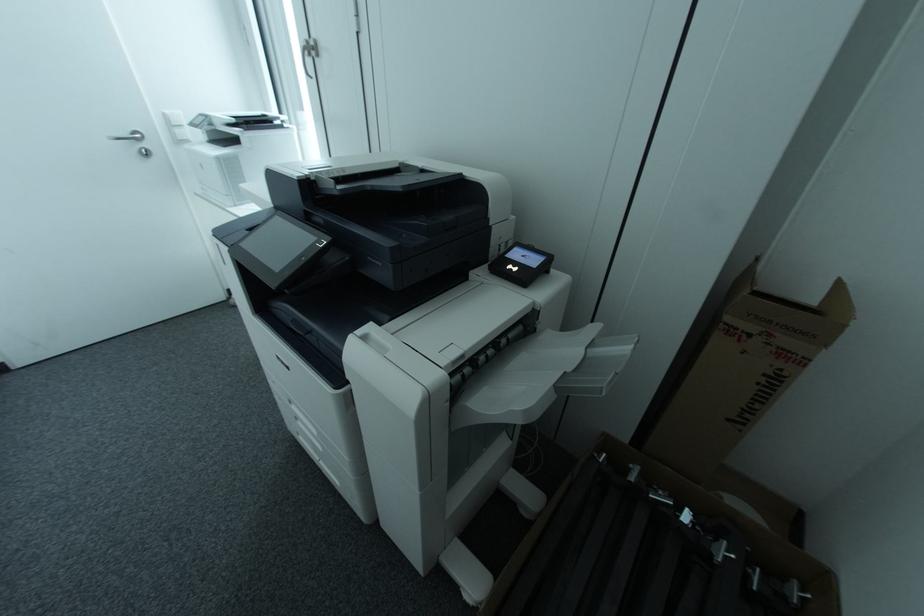
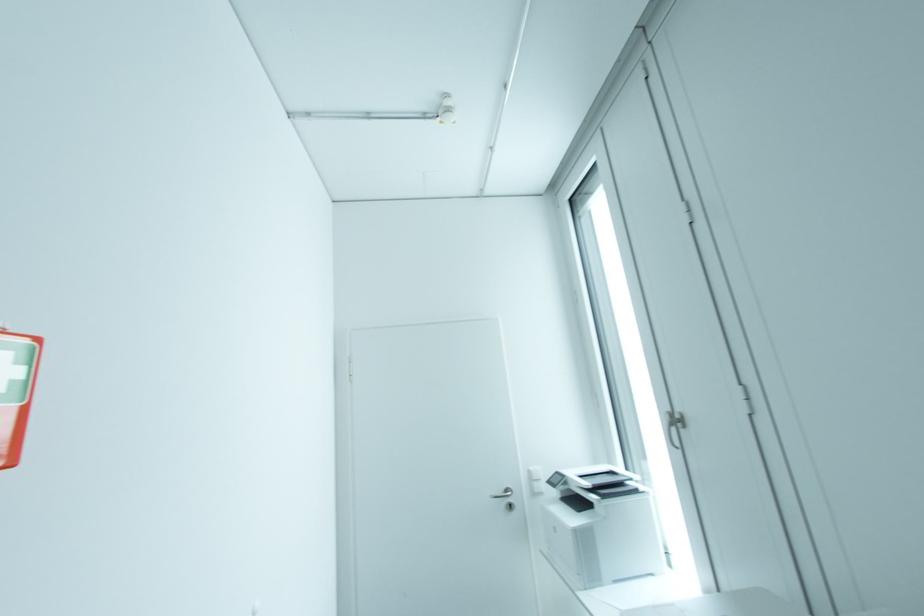
The images are taken continuously from a first-person perspective. In which direction is your viewpoint rotating?

The camera's rotation is toward left-up.